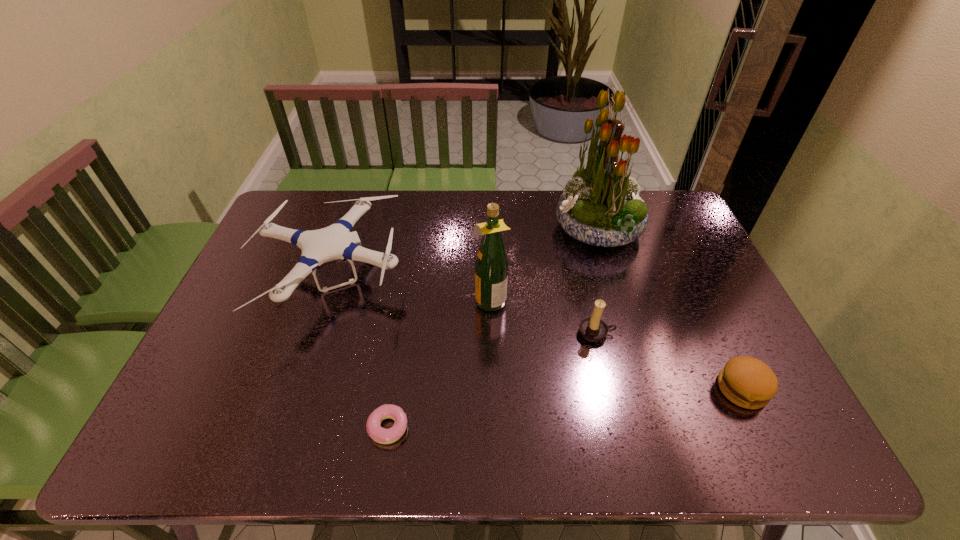
This screenshot has width=960, height=540. I want to click on object that is the fourth closest to the candle holder, so click(380, 435).

Locate an element on the screen. vacant region that satisfies the following two spatial constraints: 1. on the back side of the second shortest object; 2. on the left side of the shortest object is located at coordinates (395, 389).

The image size is (960, 540). I want to click on free spot that satisfies the following two spatial constraints: 1. on the front-facing side of the flower arrangement; 2. on the right side of the second shortest object, so click(647, 389).

At what (x,y) coordinates should I click in order to perform the action: click on vacant area in the image that satisfies the following two spatial constraints: 1. on the wick of the candle holder; 2. on the left side of the rightmost object. Please return your answer as a coordinate pair (x, y). This screenshot has width=960, height=540. Looking at the image, I should click on (610, 389).

Identify the location of free space that satisfies the following two spatial constraints: 1. on the back side of the shortest object; 2. on the right side of the hamburger. The image size is (960, 540). (395, 389).

Locate an element on the screen. vacant space that satisfies the following two spatial constraints: 1. on the front-facing side of the second tallest object; 2. on the front side of the doughnut is located at coordinates (492, 428).

Where is `vacant space that satisfies the following two spatial constraints: 1. on the front-facing side of the flower arrangement; 2. on the right side of the fifth tallest object`? The height and width of the screenshot is (540, 960). vacant space that satisfies the following two spatial constraints: 1. on the front-facing side of the flower arrangement; 2. on the right side of the fifth tallest object is located at coordinates (647, 389).

This screenshot has width=960, height=540. I want to click on vacant space that satisfies the following two spatial constraints: 1. on the front-facing side of the tallest object; 2. on the wick of the candle holder, so click(x=630, y=333).